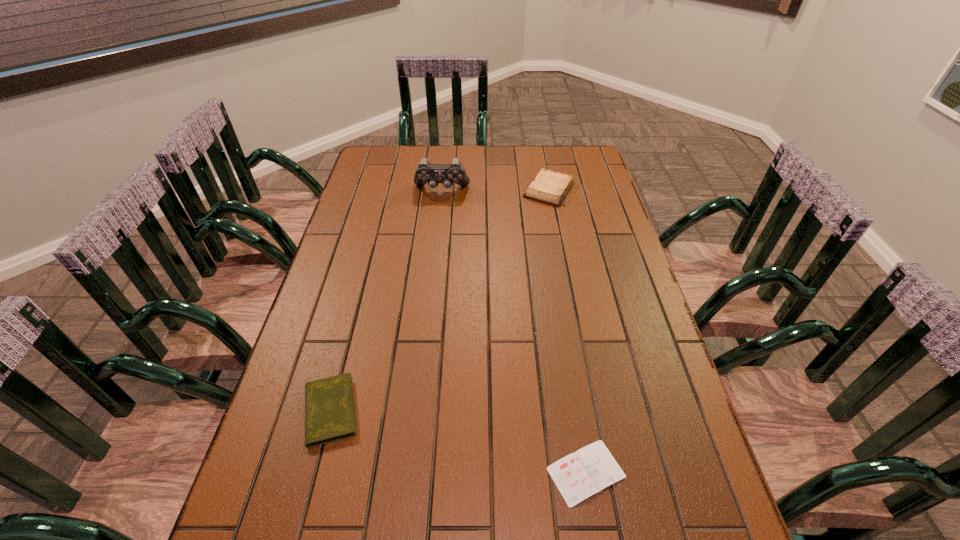
Locate an element on the screen. vacant space situated on the right of the shortest object is located at coordinates (704, 472).

Where is `object present at the far edge`? object present at the far edge is located at coordinates (550, 187).

What are the coordinates of `object located in the left edge section of the desktop` in the screenshot? It's located at (329, 403).

The height and width of the screenshot is (540, 960). I want to click on object that is at the far right corner, so click(550, 187).

The height and width of the screenshot is (540, 960). In the image, there is a desktop. In order to click on vacant space at the far edge in this screenshot , I will do `click(432, 159)`.

The width and height of the screenshot is (960, 540). In the image, there is a desktop. What are the coordinates of `vacant space at the left edge` in the screenshot? It's located at (328, 286).

This screenshot has height=540, width=960. Identify the location of free region at the right edge of the desktop. (692, 509).

In order to click on blank area at the far left corner in this screenshot , I will do `click(386, 164)`.

At what (x,y) coordinates should I click in order to perform the action: click on vacant space at the far right corner of the desktop. Please return your answer as a coordinate pair (x, y). This screenshot has height=540, width=960. Looking at the image, I should click on (578, 146).

The image size is (960, 540). I want to click on empty location between the tallest object and the farthest diary, so click(x=495, y=190).